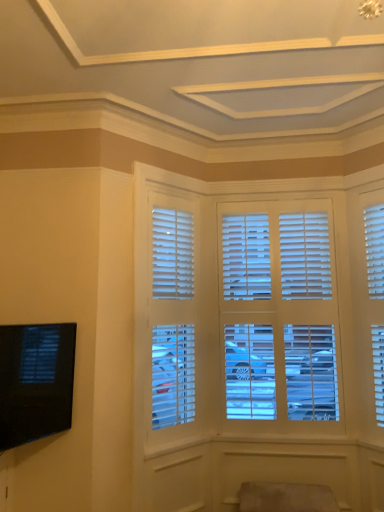
Question: Considering the positions of white matte blinds at center and suede-like beige swivel chair at lower center in the image, is white matte blinds at center wider or thinner than suede-like beige swivel chair at lower center?

Choices:
 (A) wide
 (B) thin

Answer: (B)

Question: From a real-world perspective, is white matte blinds at center positioned above or below suede-like beige swivel chair at lower center?

Choices:
 (A) below
 (B) above

Answer: (B)

Question: Which is nearer to the suede-like beige swivel chair at lower center?

Choices:
 (A) white matte blinds at center
 (B) black glossy tv at lower left

Answer: (A)

Question: Which object is positioned farthest from the white matte blinds at center?

Choices:
 (A) suede-like beige swivel chair at lower center
 (B) black glossy tv at lower left

Answer: (A)